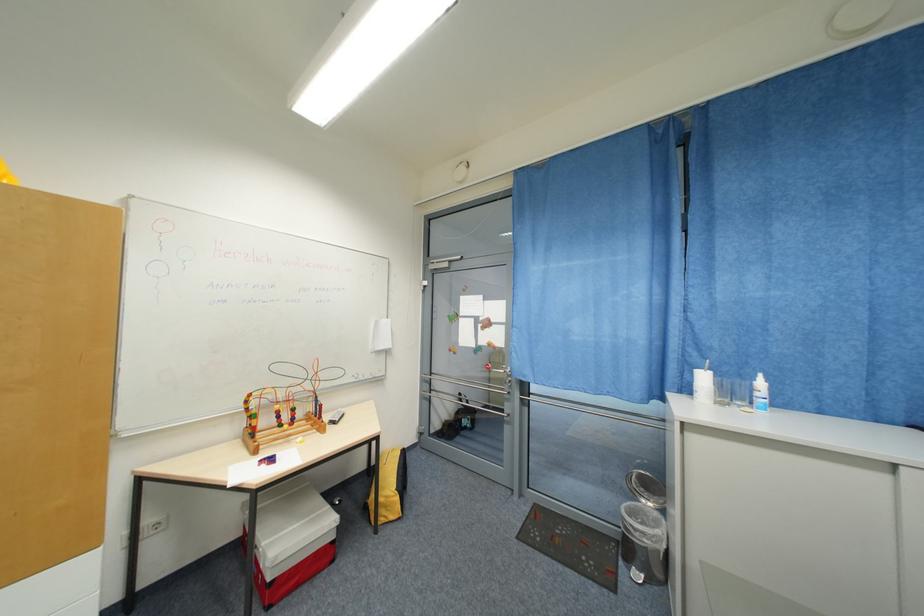
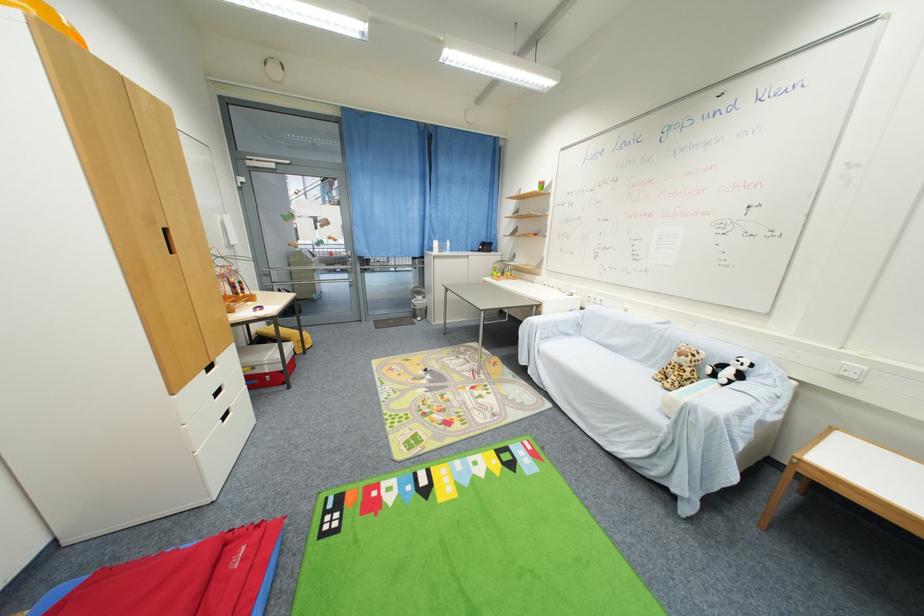
Where in the second image is the point corresponding to (x=628, y=511) from the first image?

(418, 302)